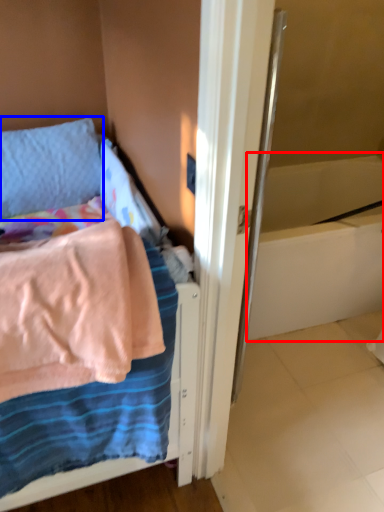
Question: Which object is further to the camera taking this photo, bath (highlighted by a red box) or pillow (highlighted by a blue box)?

Choices:
 (A) bath
 (B) pillow

Answer: (A)